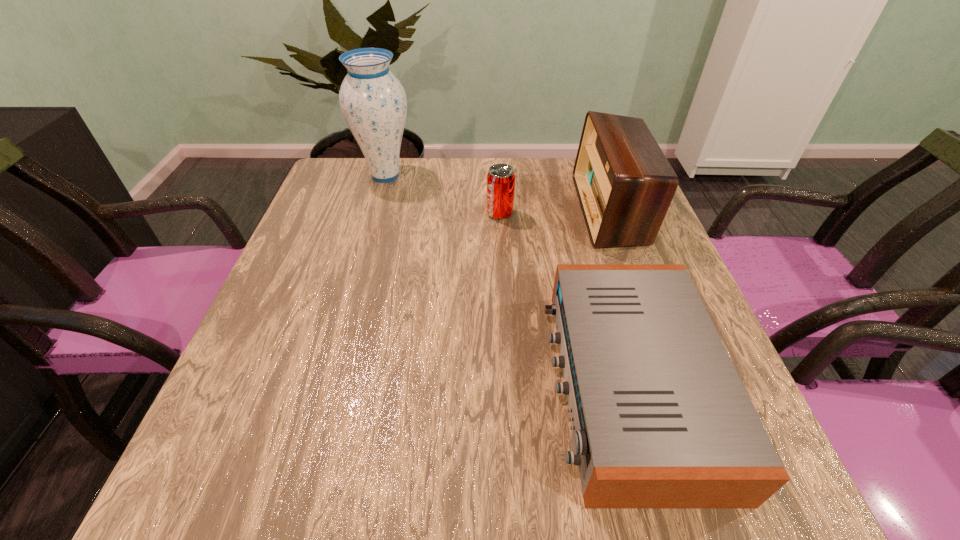
The image size is (960, 540). Identify the location of vacant region located 0.280m on the front-facing side of the taller radio receiver. (473, 210).

Image resolution: width=960 pixels, height=540 pixels. In order to click on vacant area located on the front-facing side of the taller radio receiver in this screenshot , I will do `click(454, 210)`.

Locate an element on the screen. The image size is (960, 540). vacant space positioned on the right of the second shortest object is located at coordinates (614, 214).

Locate an element on the screen. The width and height of the screenshot is (960, 540). free space located on the front panel of the shorter radio receiver is located at coordinates (330, 384).

Find the location of a particular element. vacant space located 0.170m on the front panel of the shorter radio receiver is located at coordinates (456, 384).

Locate an element on the screen. This screenshot has height=540, width=960. free space located 0.350m on the front panel of the shorter radio receiver is located at coordinates (353, 384).

Find the location of a particular element. This screenshot has width=960, height=540. vase that is at the far edge is located at coordinates (373, 102).

Where is `radio receiver that is positioned at the far edge`? The width and height of the screenshot is (960, 540). radio receiver that is positioned at the far edge is located at coordinates (625, 184).

At what (x,y) coordinates should I click in order to perform the action: click on object situated at the near edge. Please return your answer as a coordinate pair (x, y). The image size is (960, 540). Looking at the image, I should click on (660, 418).

Find the location of a particular element. This screenshot has height=540, width=960. object that is at the left edge is located at coordinates (373, 102).